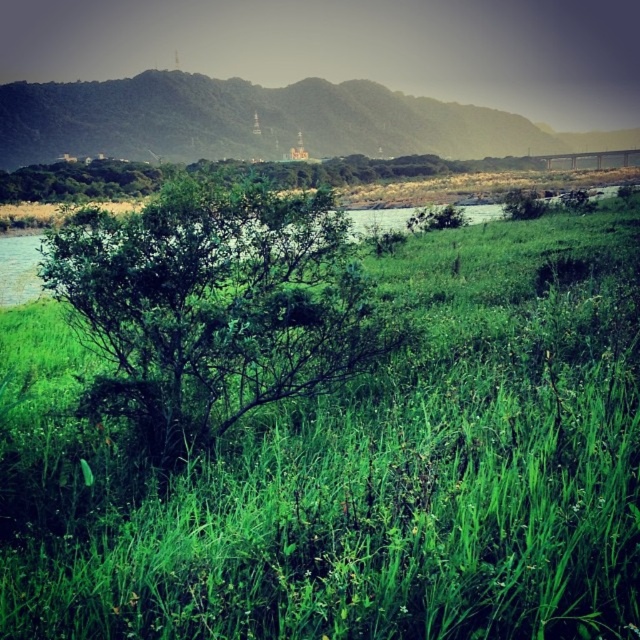
Can you confirm if green leafy bush at center is wider than green grassy hill at upper center?

No.

The width and height of the screenshot is (640, 640). I want to click on green leafy bush at center, so click(216, 307).

In the scene shown: Who is more forward, (182, 180) or (513, 141)?

Point (182, 180) is in front.

Image resolution: width=640 pixels, height=640 pixels. What are the coordinates of `green leafy bush at center` in the screenshot? It's located at 216,307.

Does green leafy grass at center have a lesser width compared to green leafy bush at center?

In fact, green leafy grass at center might be wider than green leafy bush at center.

Which is more to the right, green leafy grass at center or green leafy bush at center?

From the viewer's perspective, green leafy grass at center appears more on the right side.

Is point (586, 406) more distant than point (346, 332)?

No, (586, 406) is in front of (346, 332).

The height and width of the screenshot is (640, 640). Find the location of `green leafy grass at center`. green leafy grass at center is located at coordinates (355, 465).

Describe the element at coordinates (355, 465) in the screenshot. This screenshot has height=640, width=640. I see `green leafy grass at center` at that location.

Is green leafy grass at center above green grassy hill at upper center?

No.

Identify the location of green leafy grass at center. (355, 465).

I want to click on green leafy grass at center, so click(x=355, y=465).